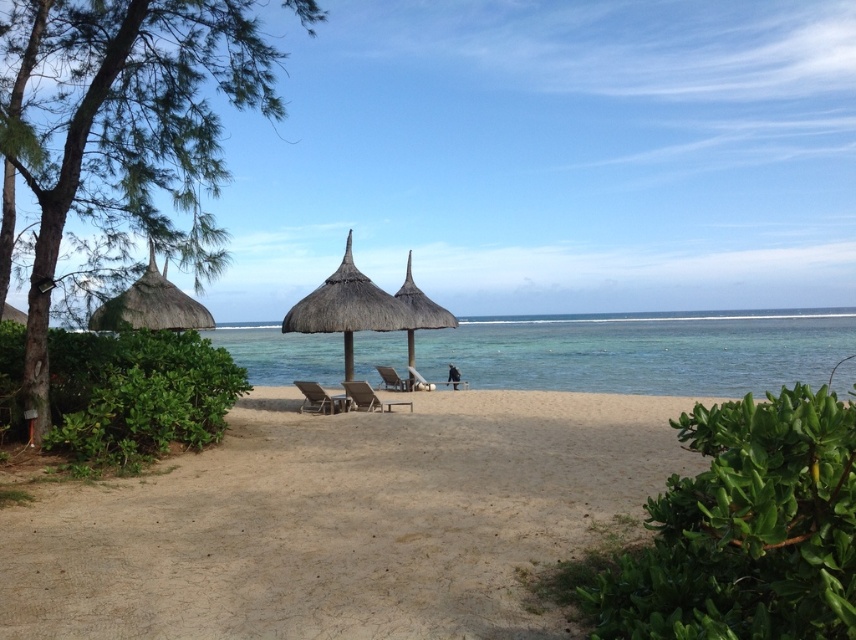
Image resolution: width=856 pixels, height=640 pixels. What do you see at coordinates (319, 397) in the screenshot?
I see `dark brown textured beach chair at center` at bounding box center [319, 397].

Which is behind, point (308, 394) or point (399, 381)?

Positioned behind is point (399, 381).

Is point (317, 384) closer to camera compared to point (379, 371)?

Yes, it is.

What are the coordinates of `dark brown textured beach chair at center` in the screenshot? It's located at (319, 397).

Does point (339, 348) lie behind point (321, 404)?

Yes, point (339, 348) is behind point (321, 404).

The image size is (856, 640). Find the location of `clear blue water at center`. clear blue water at center is located at coordinates (x=642, y=353).

Between point (443, 365) and point (324, 396), which one is positioned in front?

Positioned in front is point (324, 396).

This screenshot has width=856, height=640. I want to click on clear blue water at center, so click(642, 353).

Is point (313, 298) farther from viewer compared to point (421, 326)?

No, it is not.

Which is in front, point (366, 307) or point (401, 288)?

Point (366, 307) is more forward.

Where is `thatched straw umbrella at center`? thatched straw umbrella at center is located at coordinates (348, 307).